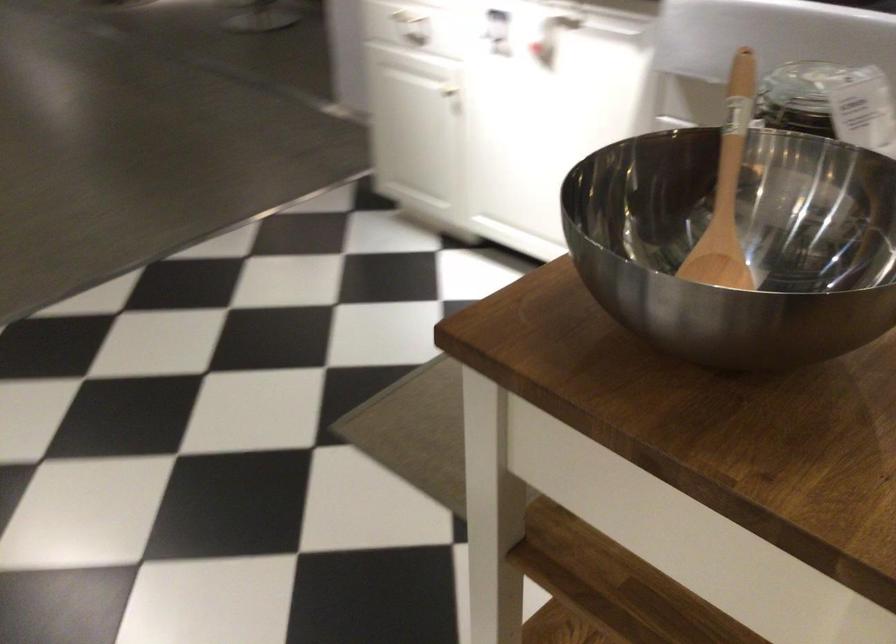
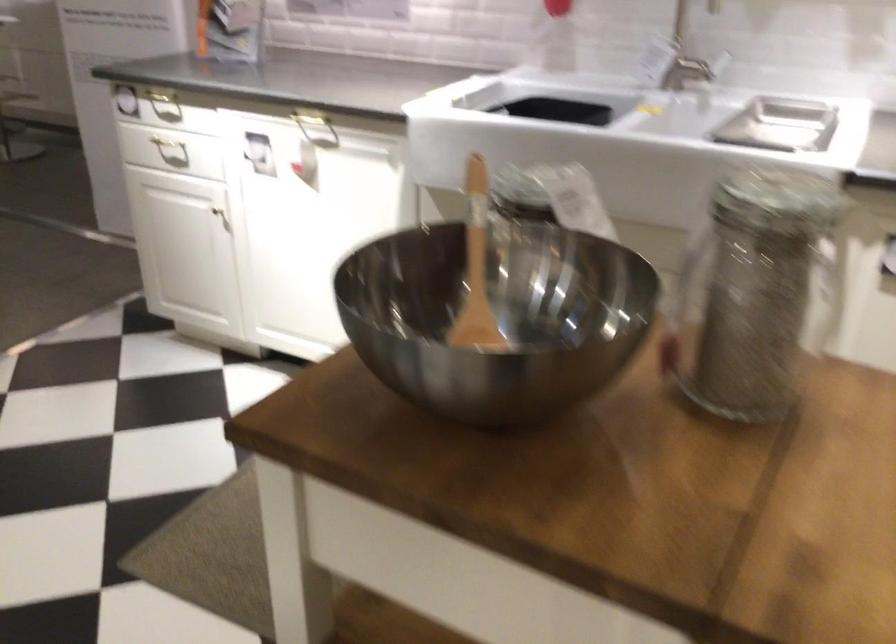
Question: The camera is either moving clockwise (left) or counter-clockwise (right) around the object. The first image is from the beginning of the video and the second image is from the end. Is the camera moving left or right when shooting the video?

Choices:
 (A) Left
 (B) Right

Answer: (A)